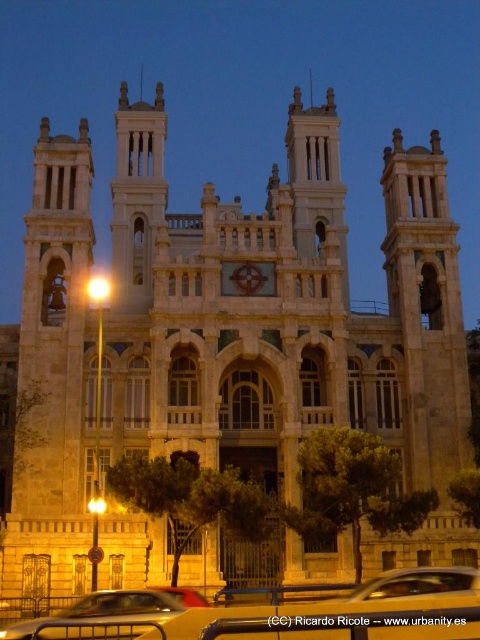
Between metallic silver car at center and metallic silver car at lower center, which one appears on the left side from the viewer's perspective?

From the viewer's perspective, metallic silver car at lower center appears more on the left side.

Which of these two, metallic silver car at center or metallic silver car at lower center, stands shorter?

metallic silver car at lower center is shorter.

This screenshot has height=640, width=480. I want to click on metallic silver car at center, so click(x=286, y=612).

Identify the location of metallic silver car at center. (286, 612).